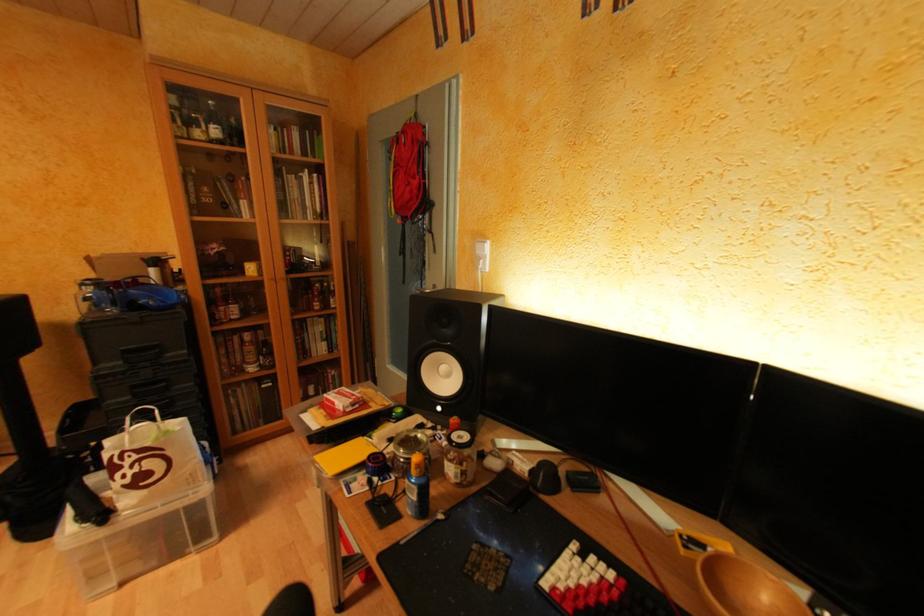
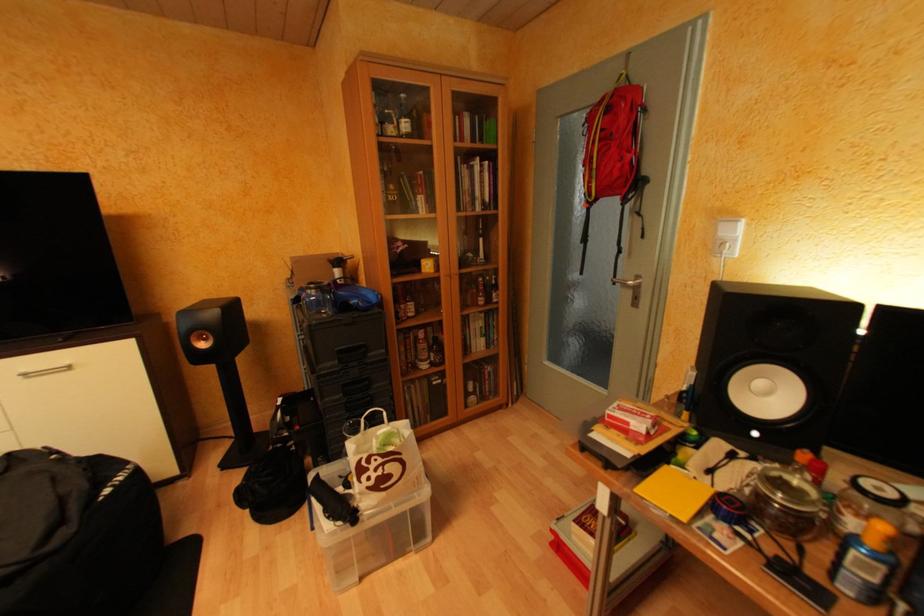
Question: Based on the continuous images, in which direction is the camera rotating? Reply with the corresponding letter.

Choices:
 (A) Left
 (B) Right
 (C) Up
 (D) Down

Answer: (A)